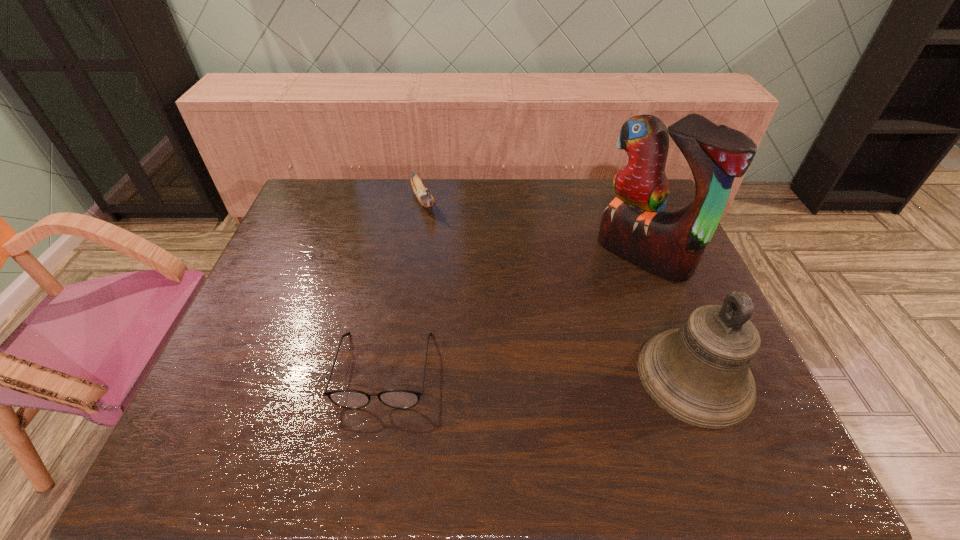
Where is `vacant region between the parrot and the third shortest object`? Image resolution: width=960 pixels, height=540 pixels. vacant region between the parrot and the third shortest object is located at coordinates (669, 315).

Image resolution: width=960 pixels, height=540 pixels. I want to click on vacant space that is in between the second farthest object and the second shortest object, so click(533, 228).

Where is `free space between the spectacles and the banana`? This screenshot has width=960, height=540. free space between the spectacles and the banana is located at coordinates (404, 285).

I want to click on vacant area that lies between the third shortest object and the third nearest object, so click(669, 315).

Choose which object is the second nearest neighbor to the third nearest object. Please provide its 2D coordinates. Your answer should be formatted as a tuple, i.e. [(x, y)], where the tuple contains the x and y coordinates of a point satisfying the conditions above.

[(352, 399)]

Locate which object ranks second in proximity to the bell. Please provide its 2D coordinates. Your answer should be formatted as a tuple, i.e. [(x, y)], where the tuple contains the x and y coordinates of a point satisfying the conditions above.

[(352, 399)]

At what (x,y) coordinates should I click in order to perform the action: click on vacant region that satisfies the following two spatial constraints: 1. on the front side of the bell; 2. on the right side of the tallest object. Please return your answer as a coordinate pair (x, y). Looking at the image, I should click on (690, 376).